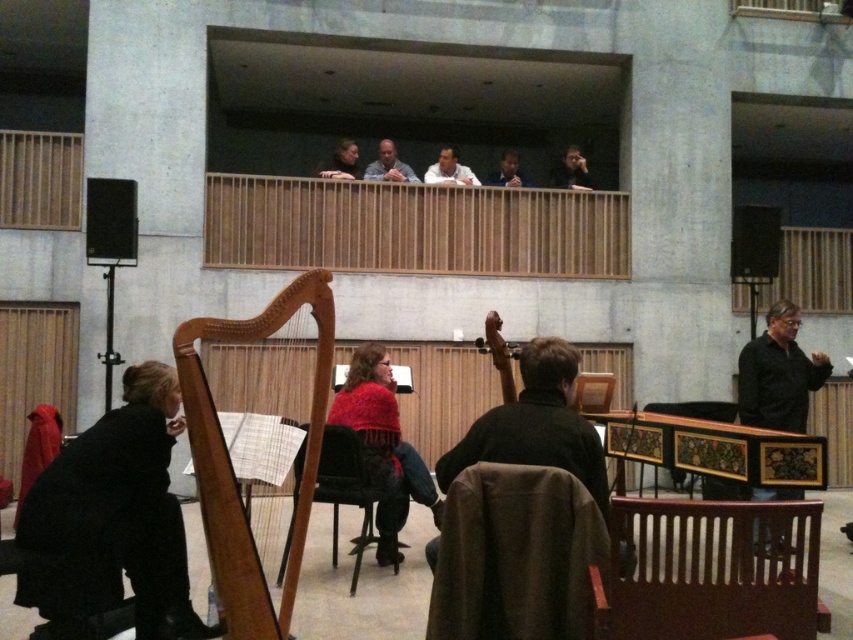
Question: Considering the real-world distances, which object is farthest from the wooden cello at center?

Choices:
 (A) matte gray shirt at upper center
 (B) smooth brown leather jacket at upper center
 (C) dark brown wood chair at upper center
 (D) white shirt at upper center

Answer: (B)

Question: Can you confirm if knitted red shawl at center is positioned to the right of smooth brown leather jacket at upper center?

Choices:
 (A) yes
 (B) no

Answer: (B)

Question: Can you confirm if wooden harp at lower left is thinner than smooth brown leather jacket at upper center?

Choices:
 (A) yes
 (B) no

Answer: (B)

Question: Which point is farther from the camera taking this photo?

Choices:
 (A) (503, 180)
 (B) (334, 488)

Answer: (A)

Question: Which of these objects is positioned farthest from the wooden slats chair at lower right?

Choices:
 (A) white shirt at upper center
 (B) dark brown leather jacket at center
 (C) knitted red shawl at center

Answer: (A)

Question: Where is wooden cello at center located in relation to dark brown wood chair at upper center in the image?

Choices:
 (A) above
 (B) below

Answer: (B)